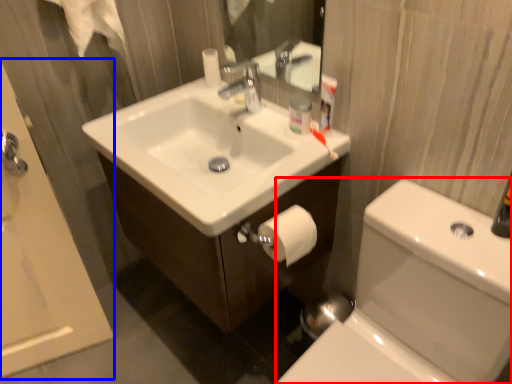
Question: Which object is further to the camera taking this photo, toilet bowl (highlighted by a red box) or bath (highlighted by a blue box)?

Choices:
 (A) toilet bowl
 (B) bath

Answer: (B)